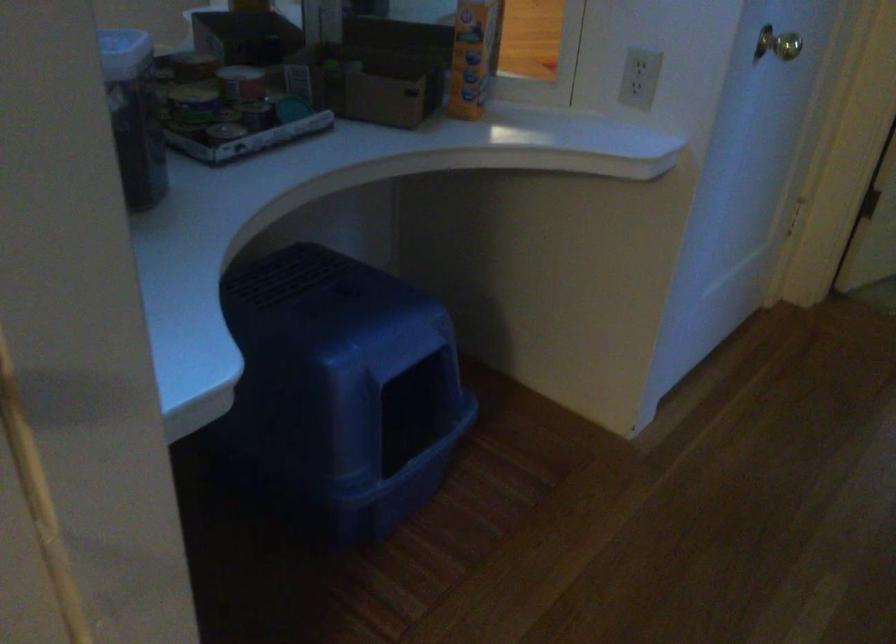
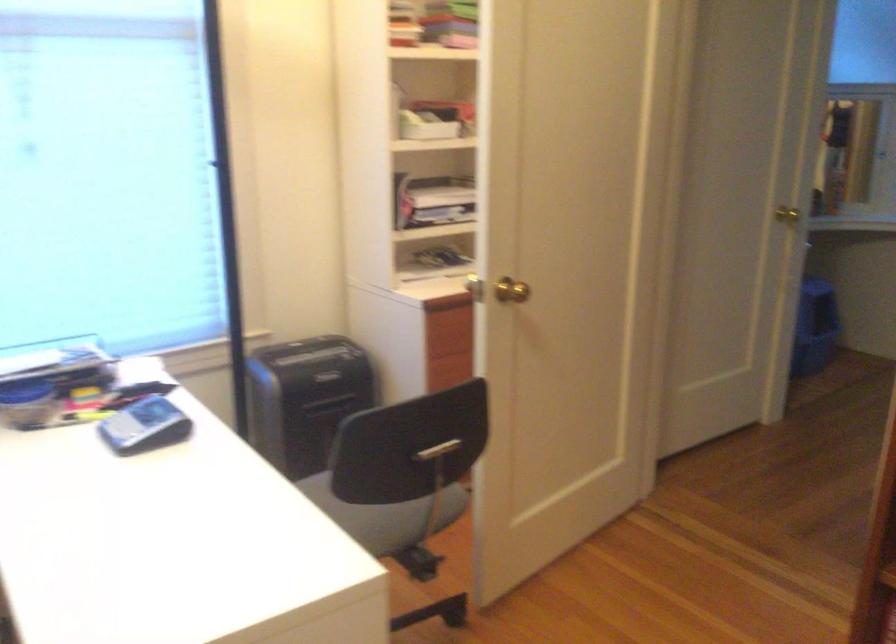
Find the pixel in the second image that matches (x=119, y=357) in the first image.

(787, 214)